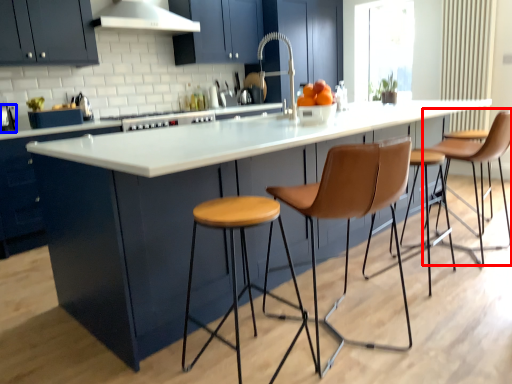
Question: Which of the following is the farthest to the observer, chair (highlighted by a red box) or appliance (highlighted by a blue box)?

Choices:
 (A) chair
 (B) appliance

Answer: (B)